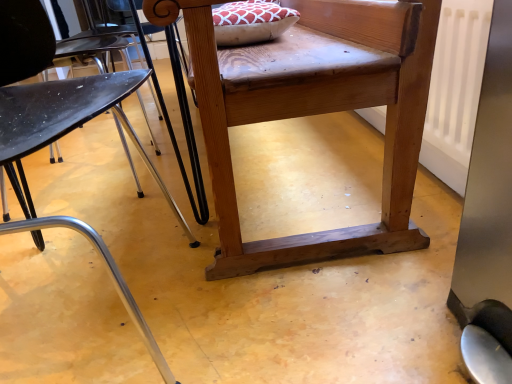
This screenshot has width=512, height=384. Identify the location of vacant space behind metallic black chair at left. (112, 220).